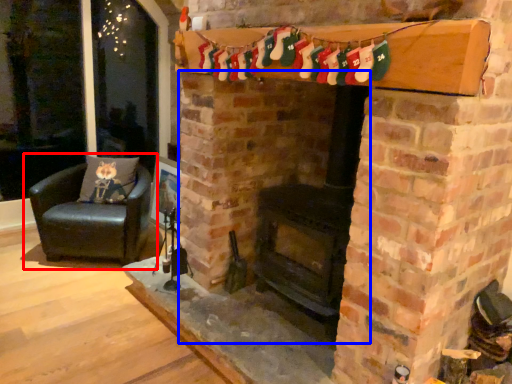
Question: Among these objects, which one is farthest to the camera, chair (highlighted by a red box) or fireplace (highlighted by a blue box)?

Choices:
 (A) chair
 (B) fireplace

Answer: (A)